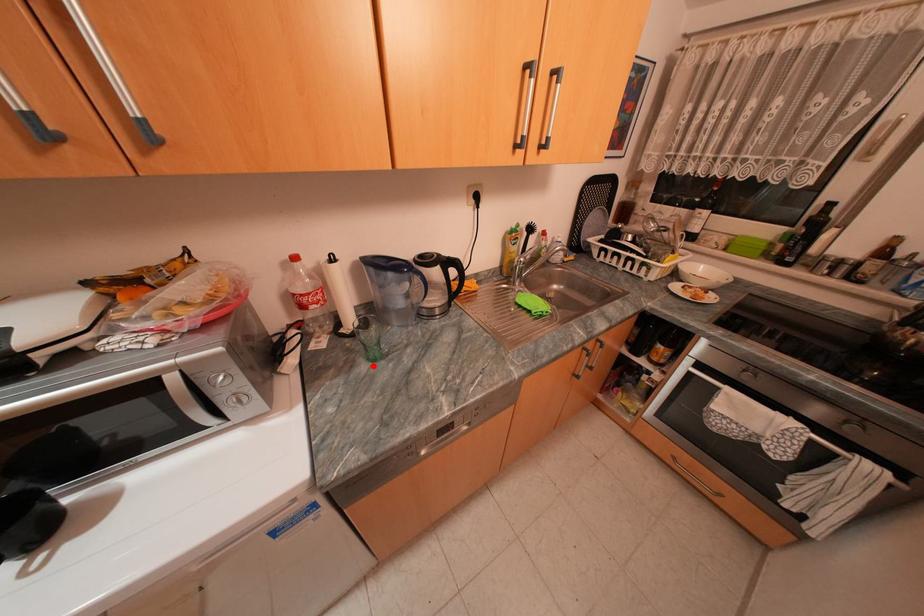
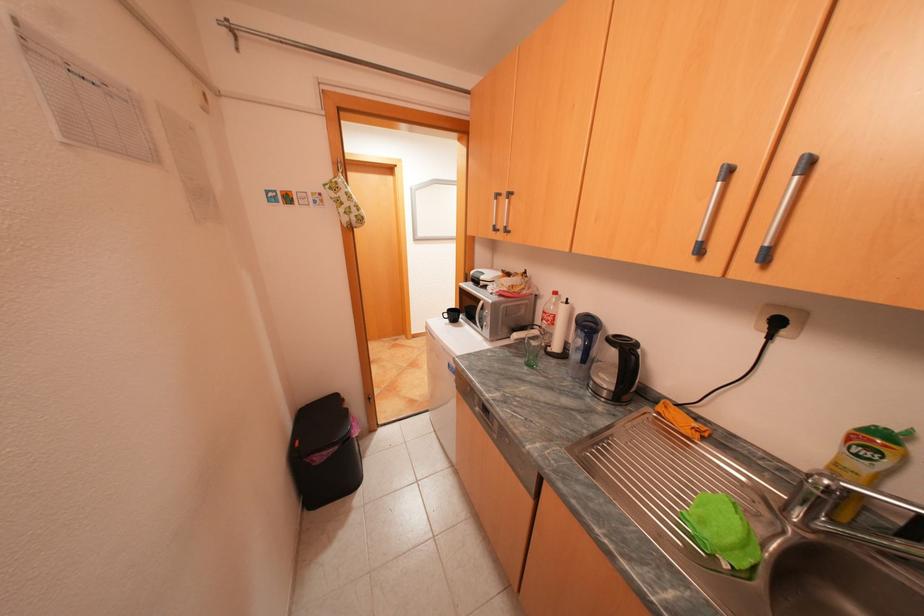
In the second image, find the point that corresponds to the highlighted location in the first image.

(530, 360)